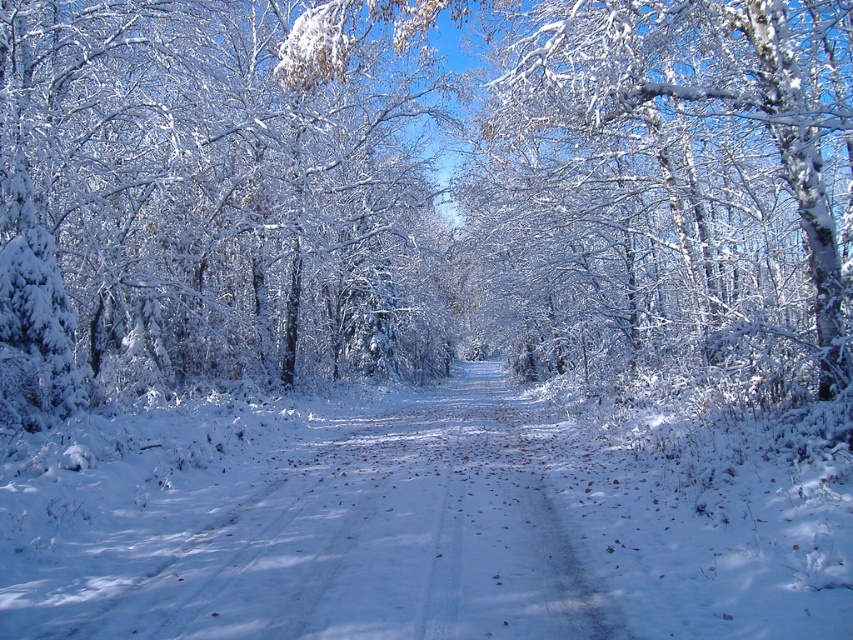
Question: Among these points, which one is farthest from the camera?

Choices:
 (A) (117, 138)
 (B) (457, 460)

Answer: (A)

Question: Where is white frosty tree at left located in relation to white snow-covered path at center in the image?

Choices:
 (A) below
 (B) above

Answer: (B)

Question: Which object is farther from the camera taking this photo?

Choices:
 (A) white snow-covered path at center
 (B) white frosty tree at left

Answer: (B)

Question: Where is white frosty tree at left located in relation to white snow-covered path at center in the image?

Choices:
 (A) right
 (B) left

Answer: (B)

Question: Which point is farther to the camera?

Choices:
 (A) white snow-covered path at center
 (B) white frosty tree at left

Answer: (B)

Question: Is white frosty tree at left positioned in front of white snow-covered path at center?

Choices:
 (A) no
 (B) yes

Answer: (A)